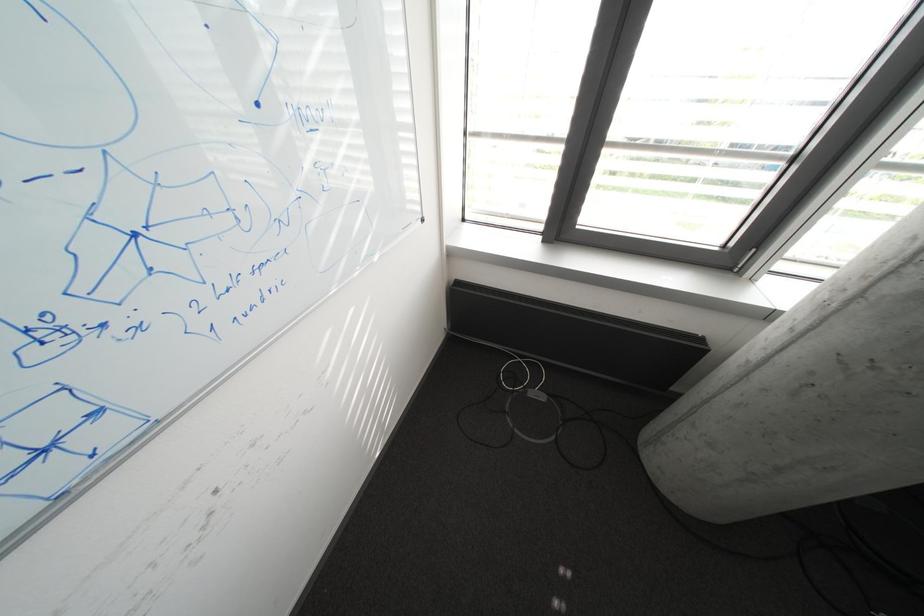
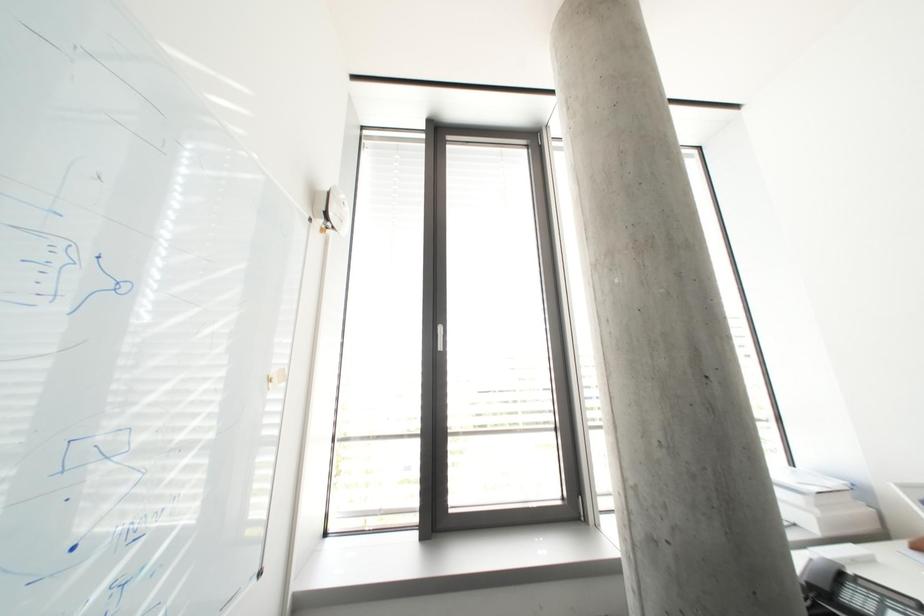
The images are taken continuously from a first-person perspective. In which direction is your viewpoint rotating?

The rotation direction of the camera is right-up.